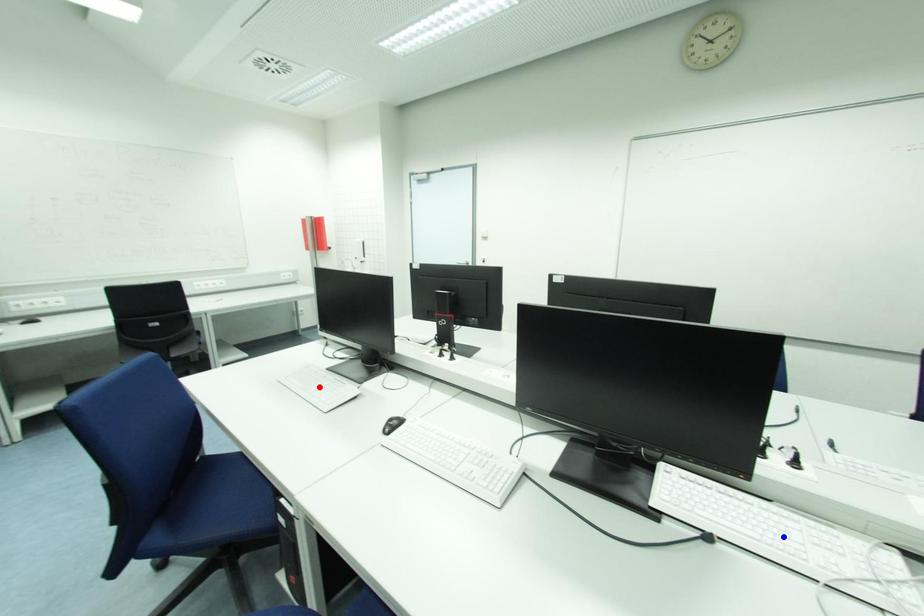
Question: In the image, two points are highlighted. Which point is nearer to the camera? Reply with the corresponding letter.

Choices:
 (A) blue point
 (B) red point

Answer: (A)